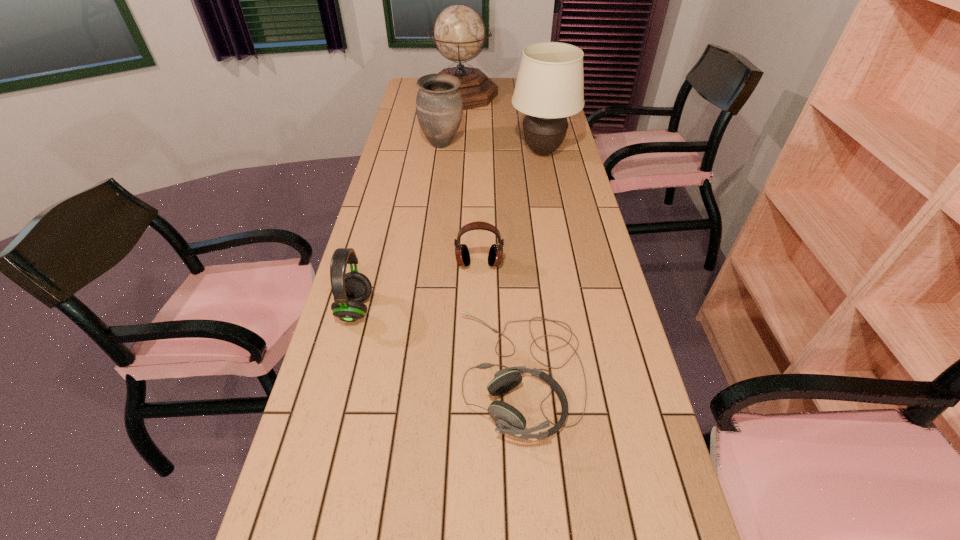
Locate an element on the screen. lampshade that is at the right edge is located at coordinates (549, 88).

Identify the location of headset at the right edge. Image resolution: width=960 pixels, height=540 pixels. (508, 420).

Where is `object situated at the far left corner`? Image resolution: width=960 pixels, height=540 pixels. object situated at the far left corner is located at coordinates (459, 33).

At what (x,y) coordinates should I click in order to perform the action: click on vacant space at the left edge of the desktop. Please return your answer as a coordinate pair (x, y). The width and height of the screenshot is (960, 540). Looking at the image, I should click on (385, 330).

Locate an element on the screen. Image resolution: width=960 pixels, height=540 pixels. vacant space at the right edge is located at coordinates 585,277.

The width and height of the screenshot is (960, 540). I want to click on unoccupied position between the lampshade and the urn, so click(492, 148).

Locate an element on the screen. free point between the fifth tallest object and the leftmost object is located at coordinates (418, 286).

Identify the location of vacant space that's between the lampshade and the fourth tallest object. Image resolution: width=960 pixels, height=540 pixels. (449, 231).

At what (x,y) coordinates should I click in order to perform the action: click on free space between the leftmost object and the lampshade. Please return your answer as a coordinate pair (x, y). Image resolution: width=960 pixels, height=540 pixels. Looking at the image, I should click on (449, 231).

Identify the location of empty space between the shortest object and the lampshade. Image resolution: width=960 pixels, height=540 pixels. (531, 262).